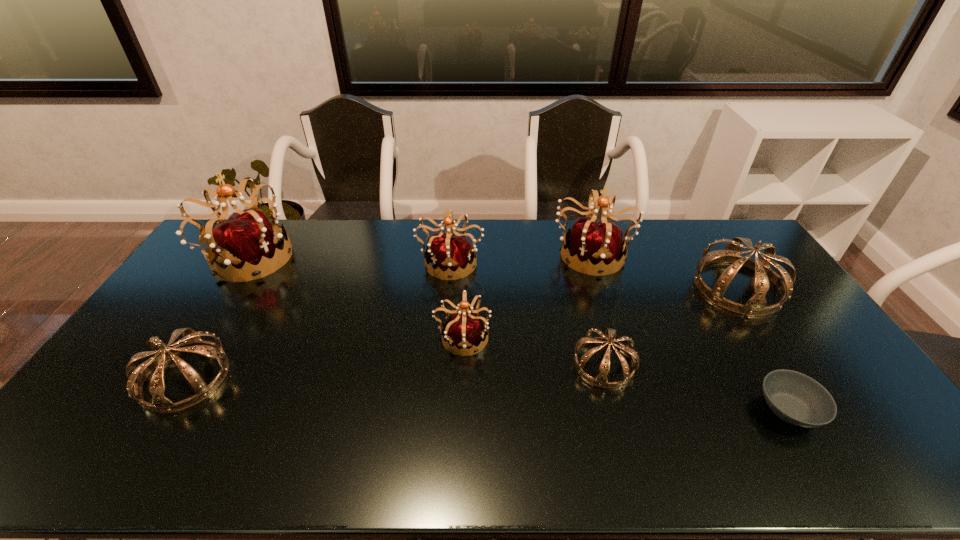
What are the coordinates of `the second brown tiara from left to right` in the screenshot? It's located at (608, 337).

This screenshot has height=540, width=960. Find the location of `soup bowl`. soup bowl is located at coordinates (795, 398).

This screenshot has width=960, height=540. In order to click on gray soup bowl in this screenshot , I will do `click(795, 398)`.

Image resolution: width=960 pixels, height=540 pixels. Identify the location of vacant space situated 0.080m on the front-facing side of the leftmost red tiara. (317, 257).

This screenshot has height=540, width=960. Identify the location of free space located 0.200m on the front-facing side of the rightmost red tiara. (612, 320).

You are a GUI agent. You are given a task and a screenshot of the screen. Output one action in this format:
    pyautogui.click(x=<x>, y=<y>)
    Task: Click on the vacant space located on the front-facing side of the second smallest red tiara
    The width and height of the screenshot is (960, 540).
    Given the screenshot: What is the action you would take?
    pyautogui.click(x=443, y=364)

I want to click on free region located on the left of the biggest brown tiara, so click(596, 287).

This screenshot has height=540, width=960. What are the coordinates of `vacant region located 0.060m on the front-facing side of the nearest red tiara` in the screenshot? It's located at (511, 338).

Locate an element on the screen. The height and width of the screenshot is (540, 960). free space located on the front of the leftmost brown tiara is located at coordinates (149, 437).

In order to click on vacant space located 0.280m on the left of the smallest brown tiara in this screenshot , I will do `click(474, 364)`.